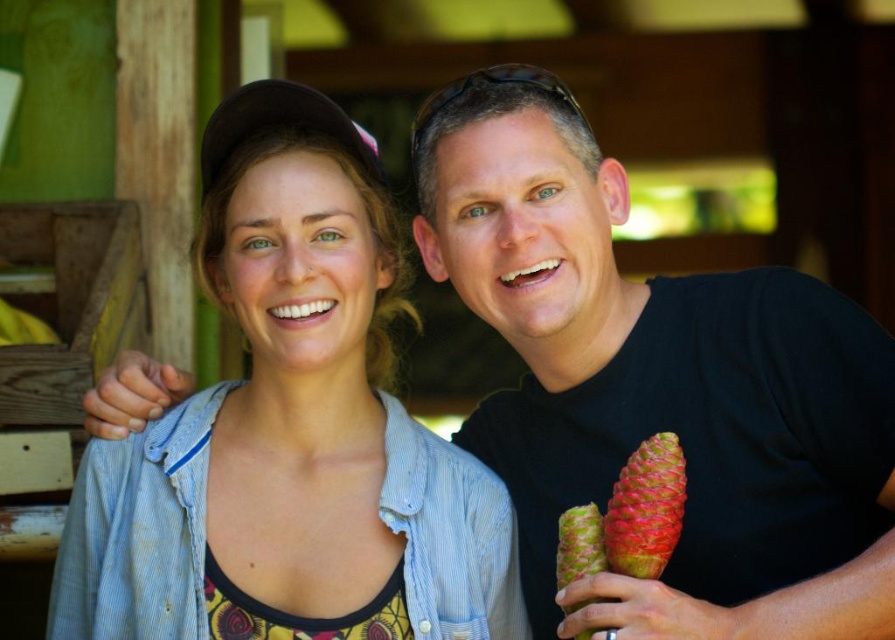
Is black matte pineapple at right below denim jacket at center?

No.

Consider the image. Does black matte pineapple at right have a greater width compared to denim jacket at center?

Incorrect, black matte pineapple at right's width does not surpass denim jacket at center's.

What do you see at coordinates (658, 385) in the screenshot? The image size is (895, 640). I see `black matte pineapple at right` at bounding box center [658, 385].

At what (x,y) coordinates should I click in order to perform the action: click on black matte pineapple at right. Please return your answer as a coordinate pair (x, y). This screenshot has width=895, height=640. Looking at the image, I should click on (658, 385).